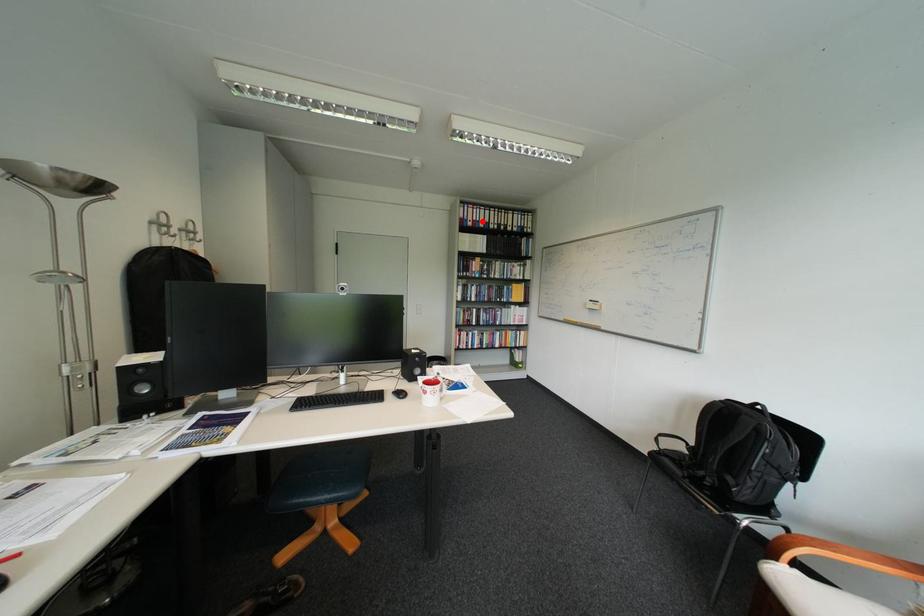
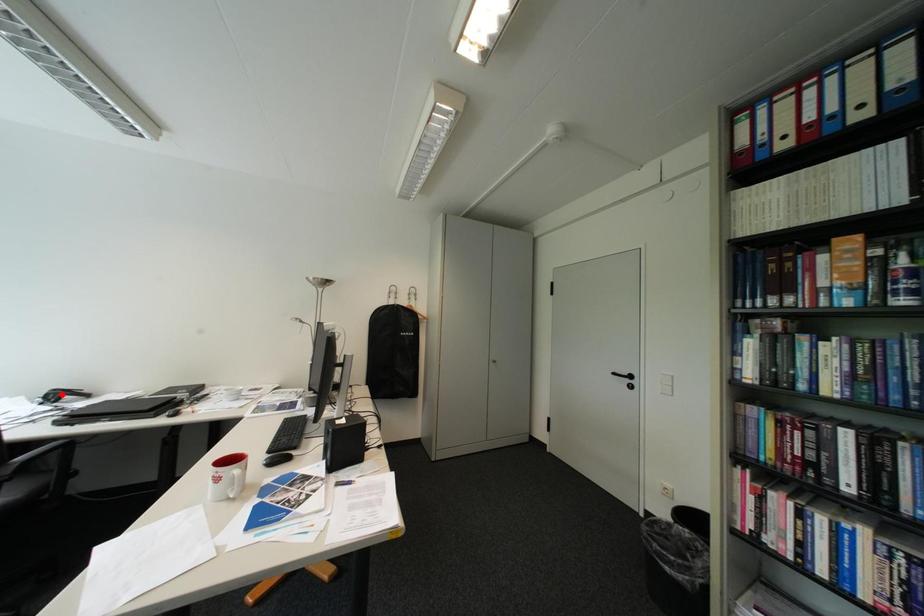
I am providing you with two images of the same scene from different viewpoints. A red point is marked on the first image and another point is marked on the second image. Does the point marked in image1 correspond to the same location as the one in image2?

No